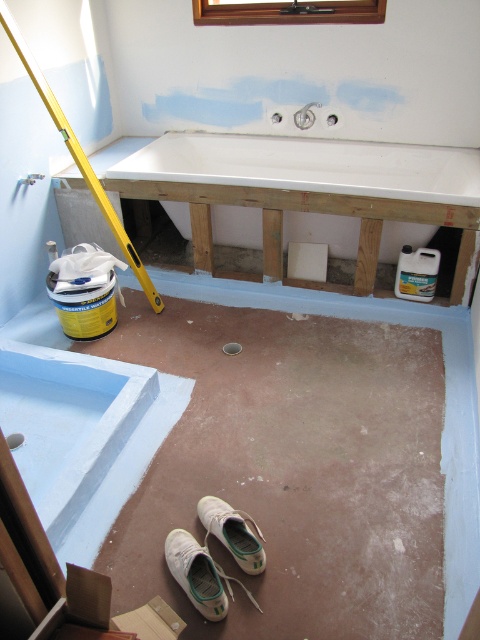
Question: Is white glossy sink at center bigger than white fabric shoe at lower center?

Choices:
 (A) no
 (B) yes

Answer: (B)

Question: Can you confirm if white canvas shoe at lower center is thinner than white fabric shoe at lower center?

Choices:
 (A) no
 (B) yes

Answer: (B)

Question: Which point appears closest to the camera in this image?

Choices:
 (A) (171, 531)
 (B) (419, 173)

Answer: (A)

Question: Considering the real-world distances, which object is closest to the white glossy sink at center?

Choices:
 (A) white fabric shoe at lower center
 (B) white canvas shoe at lower center

Answer: (A)

Question: Where is white glossy sink at center located in relation to white canvas shoe at lower center in the image?

Choices:
 (A) left
 (B) right

Answer: (B)

Question: Among these objects, which one is nearest to the camera?

Choices:
 (A) white glossy sink at center
 (B) white canvas shoe at lower center
 (C) white fabric shoe at lower center

Answer: (B)